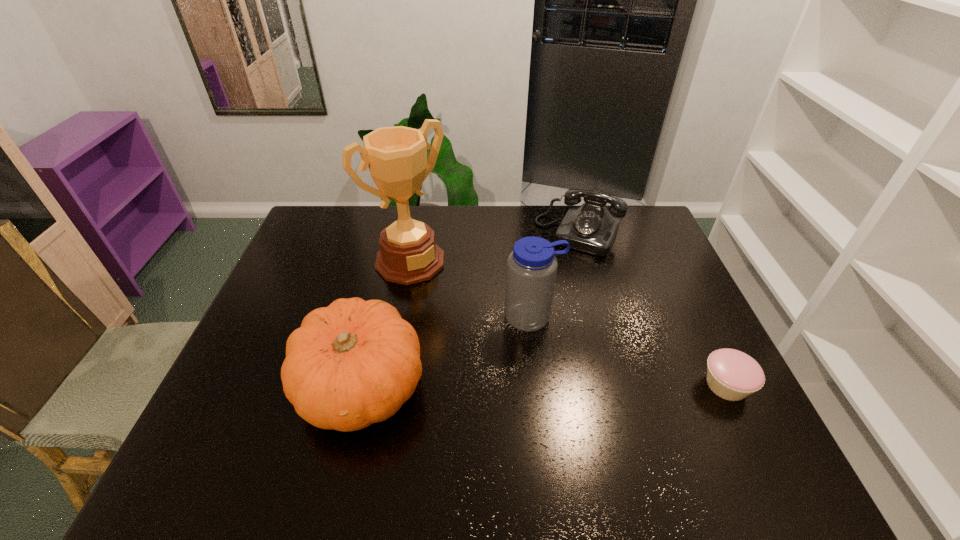
Find the location of a particular element. The height and width of the screenshot is (540, 960). pumpkin is located at coordinates (354, 363).

The height and width of the screenshot is (540, 960). Find the location of `cupcake`. cupcake is located at coordinates pos(733,375).

This screenshot has height=540, width=960. I want to click on the rightmost object, so click(x=733, y=375).

Where is `award`? award is located at coordinates (396, 156).

Where is `the third nearest object`? the third nearest object is located at coordinates [x=532, y=266].

I want to click on the second tallest object, so click(x=532, y=266).

Locate an element on the screen. the second shortest object is located at coordinates (590, 228).

Find the location of a particular element. Image resolution: width=960 pixels, height=540 pixels. blank space located 0.340m on the back of the third tallest object is located at coordinates (392, 258).

This screenshot has height=540, width=960. What are the coordinates of `vacant space located on the left of the shortest object` in the screenshot? It's located at (539, 385).

Locate an element on the screen. blank space located on the front-facing side of the tallest object is located at coordinates (505, 349).